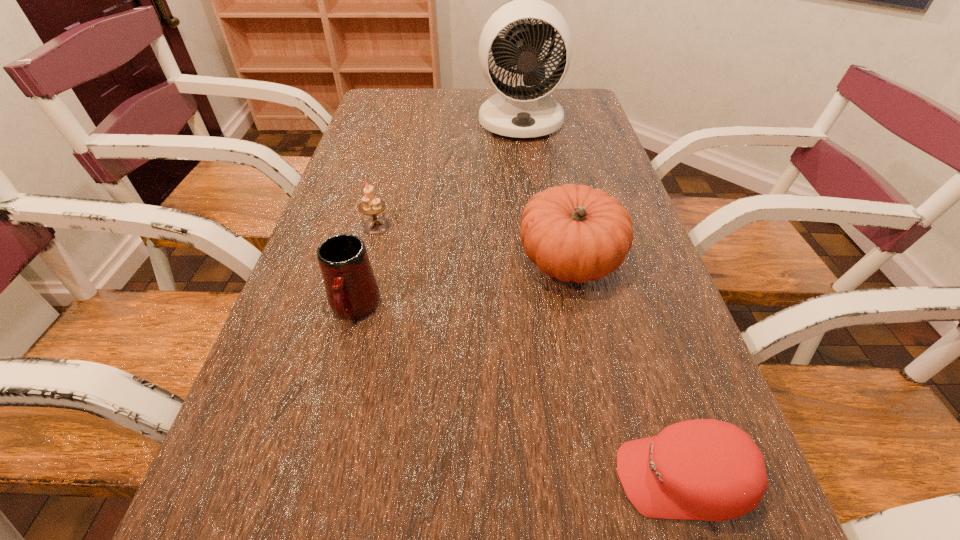
Locate an element on the screen. The height and width of the screenshot is (540, 960). blank area located 0.290m on the right of the second shortest object is located at coordinates click(x=514, y=227).

At what (x,y) coordinates should I click in order to perform the action: click on vacant space located on the front-facing side of the cap. Please return your answer as a coordinate pair (x, y). Looking at the image, I should click on (466, 478).

You are a GUI agent. You are given a task and a screenshot of the screen. Output one action in this format:
    pyautogui.click(x=<x>, y=<y>)
    Task: Click on the vacant space situated 0.110m on the front-facing side of the cap
    This screenshot has height=540, width=960.
    Given the screenshot: What is the action you would take?
    pyautogui.click(x=537, y=478)

The width and height of the screenshot is (960, 540). Find the location of `vacant space located 0.270m on the front-facing side of the cap`. vacant space located 0.270m on the front-facing side of the cap is located at coordinates (423, 478).

Locate an element on the screen. The image size is (960, 540). object that is positioned at the far edge is located at coordinates (520, 111).

I want to click on mug present at the left edge, so click(352, 291).

Identify the location of candle holder located in the left edge section of the desktop. Image resolution: width=960 pixels, height=540 pixels. (370, 205).

Identify the location of fan that is at the right edge. The width and height of the screenshot is (960, 540). (520, 111).

Identify the location of pumpkin that is at the right edge. (575, 233).

The height and width of the screenshot is (540, 960). I want to click on cap that is at the right edge, so pos(704,469).